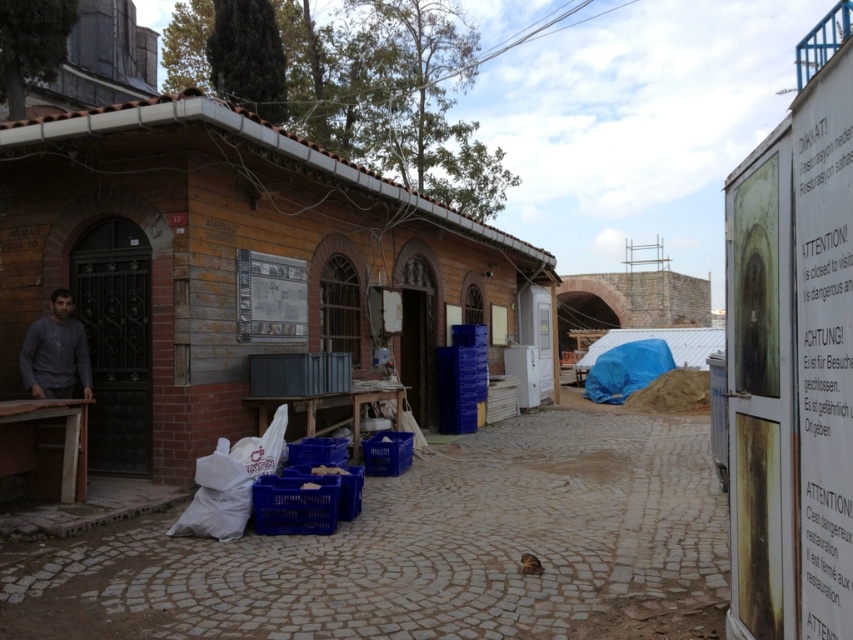
Which is in front, point (67, 280) or point (399, 632)?

Point (399, 632)

Can you confirm if brown wooden hut at left is taller than smooth cobblestone alley at center?

Indeed, brown wooden hut at left has a greater height compared to smooth cobblestone alley at center.

At what (x,y) coordinates should I click in order to perform the action: click on brown wooden hut at left. Please return your answer as a coordinate pair (x, y). Looking at the image, I should click on (229, 268).

In order to click on brown wooden hut at left in this screenshot , I will do `click(229, 268)`.

Between brown wooden hut at left and blue plastic crate at lower center, which one is positioned lower?

blue plastic crate at lower center is below.

Between brown wooden hut at left and blue plastic crate at lower center, which one has more height?

brown wooden hut at left is taller.

The height and width of the screenshot is (640, 853). What do you see at coordinates (229, 268) in the screenshot?
I see `brown wooden hut at left` at bounding box center [229, 268].

At what (x,y) coordinates should I click in order to perform the action: click on brown wooden hut at left. Please return your answer as a coordinate pair (x, y). Looking at the image, I should click on [229, 268].

Is smooth cobblestone alley at center thinner than blue plastic crate at lower center?

Incorrect, smooth cobblestone alley at center's width is not less than blue plastic crate at lower center's.

Is smooth cobblestone alley at center in front of blue plastic crate at lower center?

Yes, it is.

What do you see at coordinates (425, 548) in the screenshot? I see `smooth cobblestone alley at center` at bounding box center [425, 548].

Identify the location of smooth cobblestone alley at center. (425, 548).